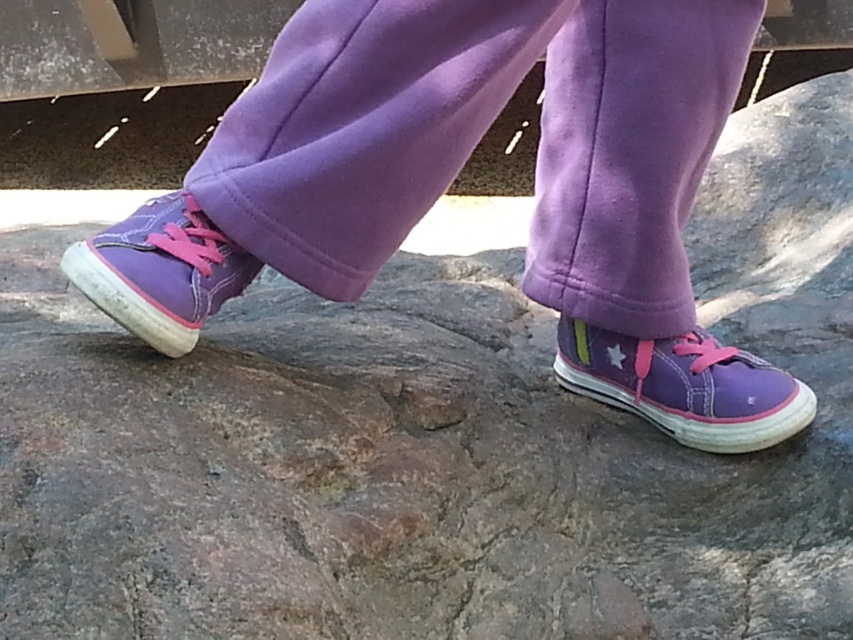
Can you confirm if purple fleece pants at center is taller than purple canvas shoe at center?

Yes.

Between point (415, 156) and point (775, 387), which one is positioned behind?

The point (775, 387) is more distant.

Locate an element on the screen. This screenshot has height=640, width=853. purple fleece pants at center is located at coordinates (479, 138).

Is purple canvas shoe at center thinner than matte purple sneaker at center?

In fact, purple canvas shoe at center might be wider than matte purple sneaker at center.

Based on the photo, which is above, purple canvas shoe at center or matte purple sneaker at center?

Positioned higher is matte purple sneaker at center.

Describe the element at coordinates (685, 387) in the screenshot. I see `purple canvas shoe at center` at that location.

Where is `purple canvas shoe at center`? This screenshot has height=640, width=853. purple canvas shoe at center is located at coordinates (685, 387).

Does purple fleece pants at center appear on the left side of matte purple sneaker at center?

In fact, purple fleece pants at center is to the right of matte purple sneaker at center.

Does point (245, 170) come farther from viewer compared to point (169, 280)?

Yes, it is behind point (169, 280).

What do you see at coordinates (479, 138) in the screenshot? This screenshot has height=640, width=853. I see `purple fleece pants at center` at bounding box center [479, 138].

Where is `purple fleece pants at center`? The height and width of the screenshot is (640, 853). purple fleece pants at center is located at coordinates 479,138.